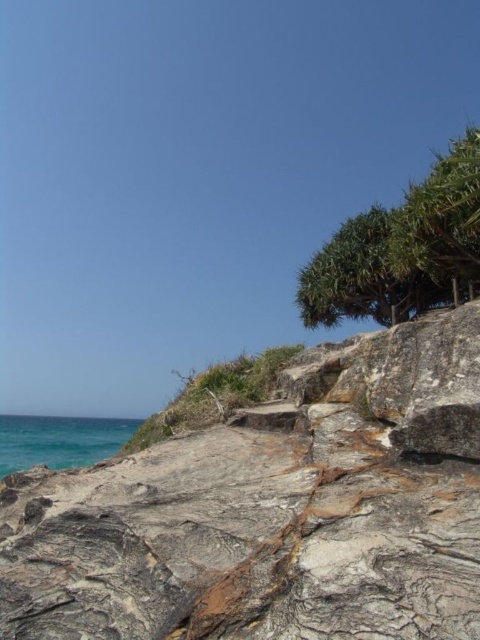
How far apart are gray rough rock at lower left and teal water at lower left?

gray rough rock at lower left is 84.64 feet away from teal water at lower left.

Can you confirm if gray rough rock at lower left is positioned to the right of teal water at lower left?

Yes, gray rough rock at lower left is to the right of teal water at lower left.

Who is more distant from viewer, [183,576] or [52,449]?

The point [52,449] is more distant.

Locate an element on the screen. Image resolution: width=480 pixels, height=640 pixels. gray rough rock at lower left is located at coordinates (274, 512).

Which is above, green leafy tree at upper right or teal water at lower left?

green leafy tree at upper right

Can you confirm if green leafy tree at upper right is wider than teal water at lower left?

No, green leafy tree at upper right is not wider than teal water at lower left.

Describe the element at coordinates (402, 250) in the screenshot. The height and width of the screenshot is (640, 480). I see `green leafy tree at upper right` at that location.

Identify the location of green leafy tree at upper right. (402, 250).

Between gray rough rock at lower left and green leafy tree at upper right, which one appears on the left side from the viewer's perspective?

From the viewer's perspective, gray rough rock at lower left appears more on the left side.

Does point (387, 602) lie behind point (324, 307)?

No, (387, 602) is closer to viewer.

You are a GUI agent. You are given a task and a screenshot of the screen. Output one action in this format:
    pyautogui.click(x=<x>, y=<y>)
    Task: Click on the gray rough rock at lower left
    The image size is (480, 640).
    Given the screenshot: What is the action you would take?
    pyautogui.click(x=274, y=512)